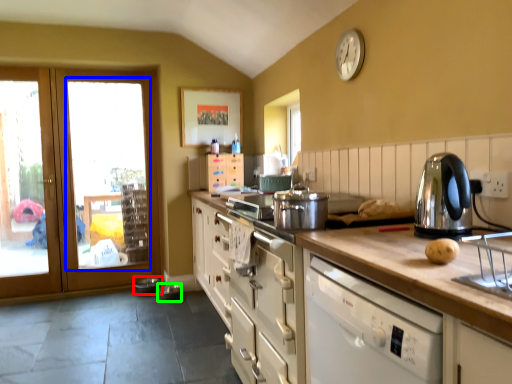
Question: Estimate the real-world distances between objects in this image. Which object is farther from appliance (highlighted by a red box), window (highlighted by a blue box) or appliance (highlighted by a green box)?

Choices:
 (A) window
 (B) appliance

Answer: (A)